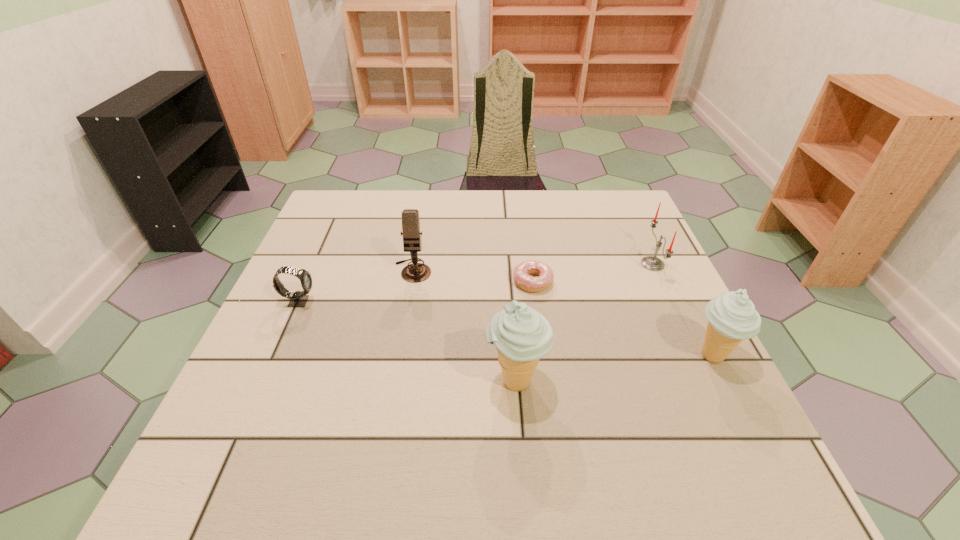
Locate an element on the screen. free region located 0.340m on the front-facing side of the candle is located at coordinates (509, 264).

At what (x,y) coordinates should I click in order to perform the action: click on vacant space located 0.220m on the front-facing side of the candle. Please return your answer as a coordinate pair (x, y). Image resolution: width=960 pixels, height=540 pixels. Looking at the image, I should click on (556, 264).

This screenshot has height=540, width=960. In order to click on free location located 0.130m on the front-facing side of the candle in this screenshot , I will do `click(590, 264)`.

Image resolution: width=960 pixels, height=540 pixels. In order to click on free space located on the front-facing side of the microphone in this screenshot , I will do `click(401, 335)`.

The width and height of the screenshot is (960, 540). I want to click on free location located on the face of the fifth tallest object, so click(x=406, y=301).

In order to click on blank space located 0.100m on the front of the doughnut in this screenshot , I will do `click(539, 327)`.

Where is `object situated at the near edge`? The image size is (960, 540). object situated at the near edge is located at coordinates (521, 335).

Image resolution: width=960 pixels, height=540 pixels. I want to click on object at the left edge, so click(298, 298).

Identify the location of icecream located in the right edge section of the desktop. Image resolution: width=960 pixels, height=540 pixels. (732, 317).

Where is `candle present at the right edge`? candle present at the right edge is located at coordinates (652, 263).